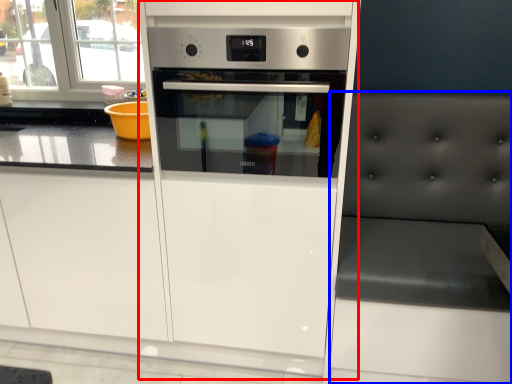
Question: Which point is further to the camera, fridge (highlighted by a red box) or chair (highlighted by a blue box)?

Choices:
 (A) fridge
 (B) chair

Answer: (A)